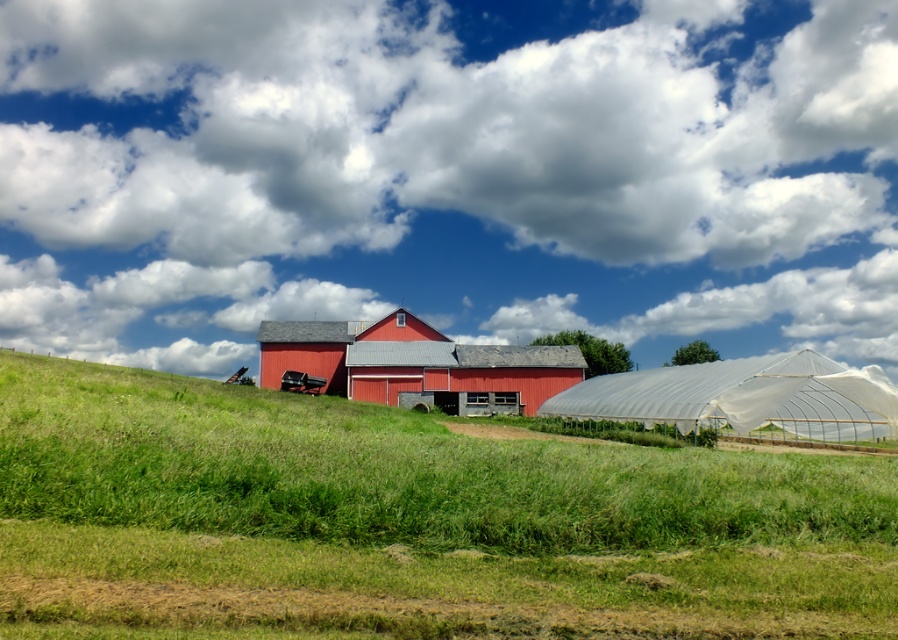
Question: Which point is closer to the camera?

Choices:
 (A) (811, 493)
 (B) (353, 372)
 (C) (168, 48)

Answer: (A)

Question: Considering the real-world distances, which object is farthest from the white fluffy cloud at upper center?

Choices:
 (A) green grassy field at lower center
 (B) matte red barn at center

Answer: (A)

Question: Can you confirm if white fluffy cloud at upper center is positioned to the left of matte red barn at center?

Choices:
 (A) no
 (B) yes

Answer: (A)

Question: Does green grassy field at lower center appear under matte red barn at center?

Choices:
 (A) no
 (B) yes

Answer: (B)

Question: Among these points, which one is farthest from the camera?

Choices:
 (A) (418, 369)
 (B) (388, 513)
 (C) (639, 209)

Answer: (C)

Question: Is white fluffy cloud at upper center smaller than green grassy field at lower center?

Choices:
 (A) yes
 (B) no

Answer: (B)